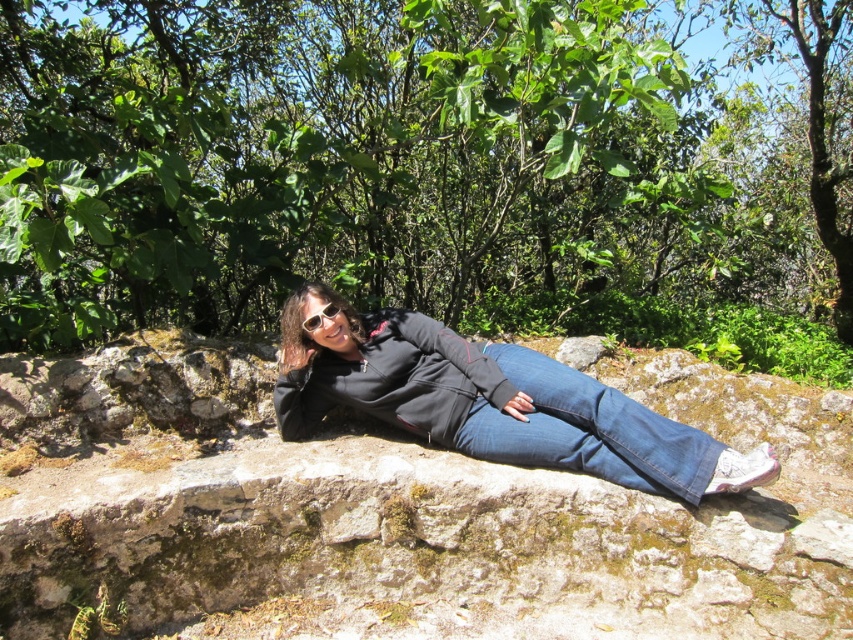
You are a hiker who wants to take a photo of the black matte jacket at center while also capturing the green leafy tree at upper center in the background. Is the tree positioned in a way that it can be seen behind the jacket in the photo?

The green leafy tree at upper center is located above the black matte jacket at center, so yes, the tree can be seen behind the jacket in the photo as it is positioned above it.

Looking at this image, you are a drone operator trying to capture aerial footage of the scene. You have two specific points to focus on, point A at coordinates point (381,65) and point B at coordinates point (521,460). Since you can only focus on one point at a time, which point should you prioritize to ensure the drone captures the person lying on the stone ledge in the foreground?

You should prioritize point B at coordinates point (521,460) because point A at coordinates point (381,65) is behind it, so focusing on point B will keep the person in the foreground.